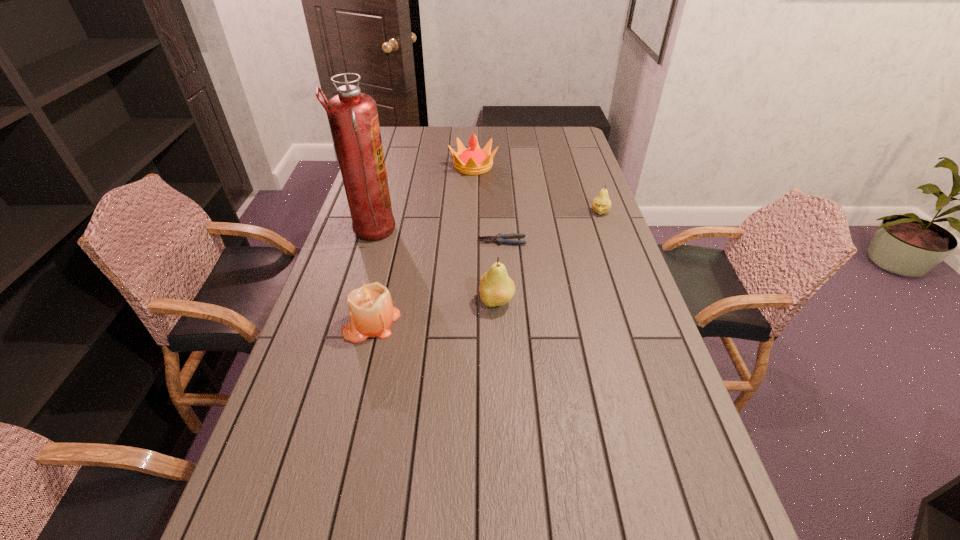
The width and height of the screenshot is (960, 540). What are the coordinates of `blank area in the image that satisfies the following two spatial constraints: 1. on the back side of the candle; 2. on the side of the tallest object with the label` in the screenshot? It's located at (394, 232).

Locate an element on the screen. The height and width of the screenshot is (540, 960). free space that satisfies the following two spatial constraints: 1. on the side of the left pear with the label; 2. on the left side of the fire extinguisher is located at coordinates (350, 302).

Where is `free space that satisfies the following two spatial constraints: 1. on the front side of the crown; 2. on the right side of the right pear`? free space that satisfies the following two spatial constraints: 1. on the front side of the crown; 2. on the right side of the right pear is located at coordinates (472, 212).